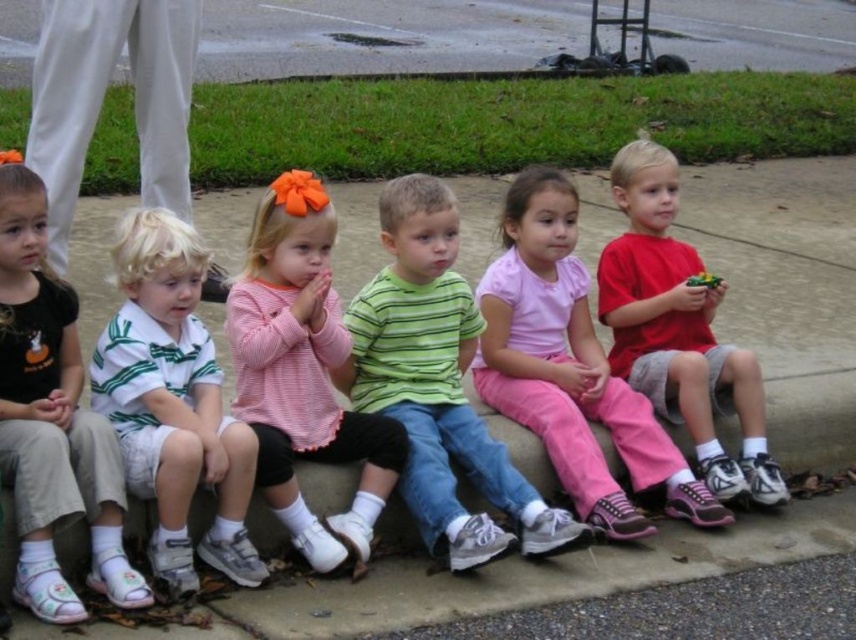
You are a photographer trying to capture a group shot of the six children sitting on the curb. You want to ensure that the child wearing the white striped polo shirt at left is centered in the frame. Given their current position at point coordinates, can you determine if the child is already centered?

The white striped polo shirt at left is located at point coordinates of (52, 420), which is not centered. To center this child, the photographer should adjust the camera angle or position to move the subject to the center of the frame.

You are standing in front of the curb where the children are sitting. You want to find the child wearing the green striped shirt at center. According to the coordinates provided, where should you look to find this child?

The green striped shirt at center is located at coordinates point [437,384], so you should look towards the center of the image to find this child.

You are a photographer taking a picture of the group of children sitting on the concrete curb. You want to ensure the green striped shirt at center is centered in the photo. Based on its current position at point 0.600, 0.512, should you move the camera to the left or right to center it?

The green striped shirt at center is currently at position 0.600 on the horizontal axis. Since 0.600 is to the right of the center point 0.5, you should move the camera slightly to the right to bring the shirt into the center of the frame.